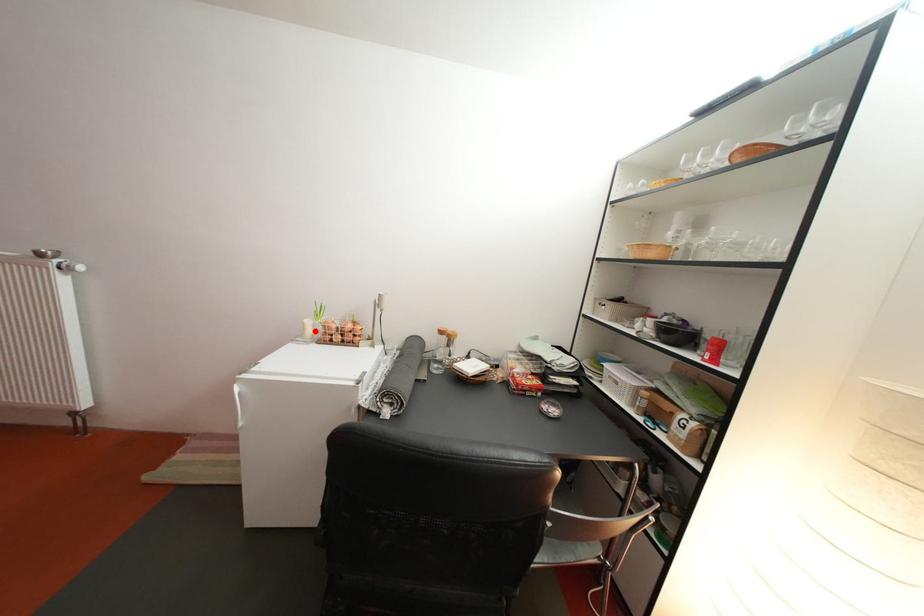
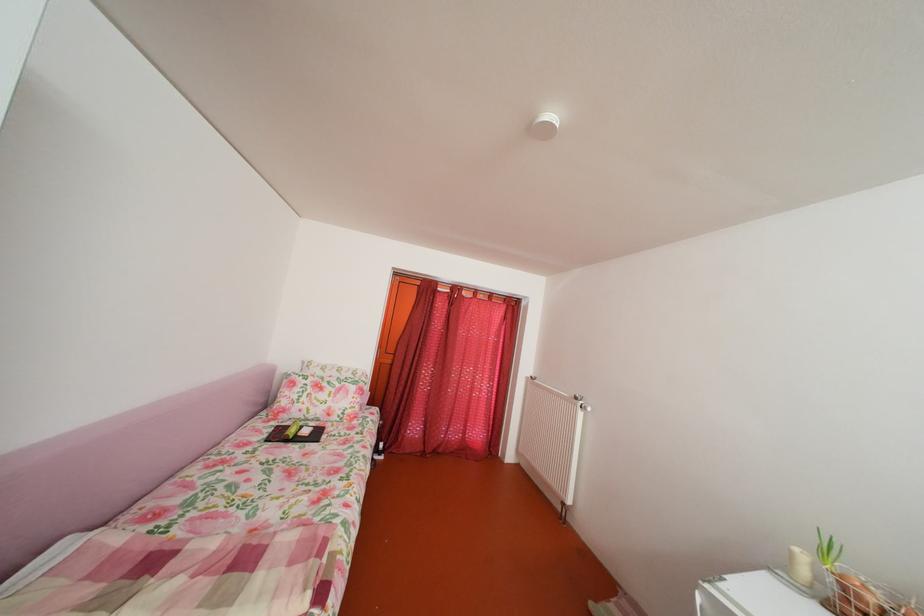
Where in the second image is the point corresponding to the highlighted location from the first image?

(803, 561)